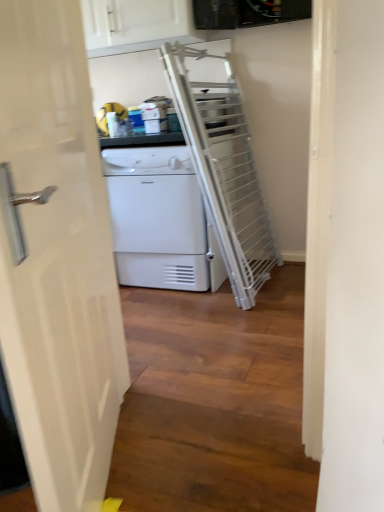
At what (x,y) coordinates should I click in order to perform the action: click on white matte/texture dryer at center. Please return your answer as a coordinate pair (x, y). This screenshot has height=512, width=384. Looking at the image, I should click on (160, 220).

What do you see at coordinates (57, 260) in the screenshot? The width and height of the screenshot is (384, 512). I see `white glossy door at left` at bounding box center [57, 260].

The height and width of the screenshot is (512, 384). What are the coordinates of `white matte/texture dryer at center` in the screenshot? It's located at (160, 220).

Which of these two, white glossy door at left or white matte/texture dryer at center, is wider?

Wider between the two is white matte/texture dryer at center.

Considering the relative sizes of white glossy door at left and white matte/texture dryer at center in the image provided, is white glossy door at left smaller than white matte/texture dryer at center?

Correct, white glossy door at left occupies less space than white matte/texture dryer at center.

Visually, is white glossy door at left positioned to the left or to the right of white matte/texture dryer at center?

white glossy door at left is positioned on white matte/texture dryer at center's left side.

Is white glossy cabinet at upper center far away from white matte/texture dryer at center?

Actually, white glossy cabinet at upper center and white matte/texture dryer at center are a little close together.

Does white glossy cabinet at upper center have a smaller size compared to white matte/texture dryer at center?

Yes.

From the image's perspective, is white glossy cabinet at upper center positioned above or below white matte/texture dryer at center?

Clearly, from the image's perspective, white glossy cabinet at upper center is above white matte/texture dryer at center.

Is white matte/texture dryer at center positioned with its back to white glossy door at left?

No, white glossy door at left is not at the back of white matte/texture dryer at center.

Which is farther from the camera, (x=147, y=224) or (x=83, y=286)?

Positioned behind is point (x=147, y=224).

Is white glossy door at left located within white matte/texture dryer at center?

No, white matte/texture dryer at center does not contain white glossy door at left.

Can you confirm if white matte/texture dryer at center is bigger than white glossy door at left?

Indeed, white matte/texture dryer at center has a larger size compared to white glossy door at left.

Based on the photo, from the image's perspective, would you say white glossy door at left is positioned over white glossy cabinet at upper center?

Incorrect, from the image's perspective, white glossy door at left is lower than white glossy cabinet at upper center.

Would you say white glossy door at left is outside white glossy cabinet at upper center?

Yes.

Which of these two, white glossy door at left or white glossy cabinet at upper center, stands taller?

Standing taller between the two is white glossy door at left.

From a real-world perspective, who is located lower, white glossy door at left or white glossy cabinet at upper center?

In real-world perspective, white glossy door at left is lower.

Does point (148, 2) appear closer or farther from the camera than point (47, 255)?

Point (148, 2) is positioned farther from the camera compared to point (47, 255).

Based on the photo, is white glossy cabinet at upper center looking in the opposite direction of white glossy door at left?

That's not correct — white glossy cabinet at upper center is not looking away from white glossy door at left.

Can you confirm if white glossy cabinet at upper center is bigger than white glossy door at left?

Yes, white glossy cabinet at upper center is bigger than white glossy door at left.

Where is `home appliance located below the white glossy cabinet at upper center (from the image's perspective)`? home appliance located below the white glossy cabinet at upper center (from the image's perspective) is located at coordinates (160, 220).

Which object is positioned more to the left, white matte/texture dryer at center or white glossy cabinet at upper center?

white glossy cabinet at upper center is more to the left.

Is white matte/texture dryer at center outside of white glossy cabinet at upper center?

Indeed, white matte/texture dryer at center is completely outside white glossy cabinet at upper center.

This screenshot has width=384, height=512. In order to click on home appliance behind the white glossy door at left in this screenshot , I will do `click(160, 220)`.

Where is `home appliance lying in front of the white glossy cabinet at upper center`? Image resolution: width=384 pixels, height=512 pixels. home appliance lying in front of the white glossy cabinet at upper center is located at coordinates (160, 220).

Looking at the image, which one is located closer to white glossy cabinet at upper center, white matte/texture dryer at center or white glossy door at left?

white matte/texture dryer at center is closer to white glossy cabinet at upper center.

Considering their positions, is white matte/texture dryer at center positioned closer to white glossy door at left than white glossy cabinet at upper center?

white matte/texture dryer at center is closer to white glossy door at left.

From the image, which object appears to be nearer to white glossy door at left, white glossy cabinet at upper center or white matte/texture dryer at center?

Among the two, white matte/texture dryer at center is located nearer to white glossy door at left.

When comparing their distances from white glossy cabinet at upper center, does white glossy door at left or white matte/texture dryer at center seem closer?

white matte/texture dryer at center is closer to white glossy cabinet at upper center.

From the picture: Based on their spatial positions, is white glossy cabinet at upper center or white glossy door at left further from white matte/texture dryer at center?

white glossy door at left is further to white matte/texture dryer at center.

From the image, which object appears to be farther from white matte/texture dryer at center, white glossy door at left or white glossy cabinet at upper center?

white glossy door at left lies further to white matte/texture dryer at center than the other object.

I want to click on home appliance positioned between white glossy door at left and white glossy cabinet at upper center from near to far, so click(x=160, y=220).